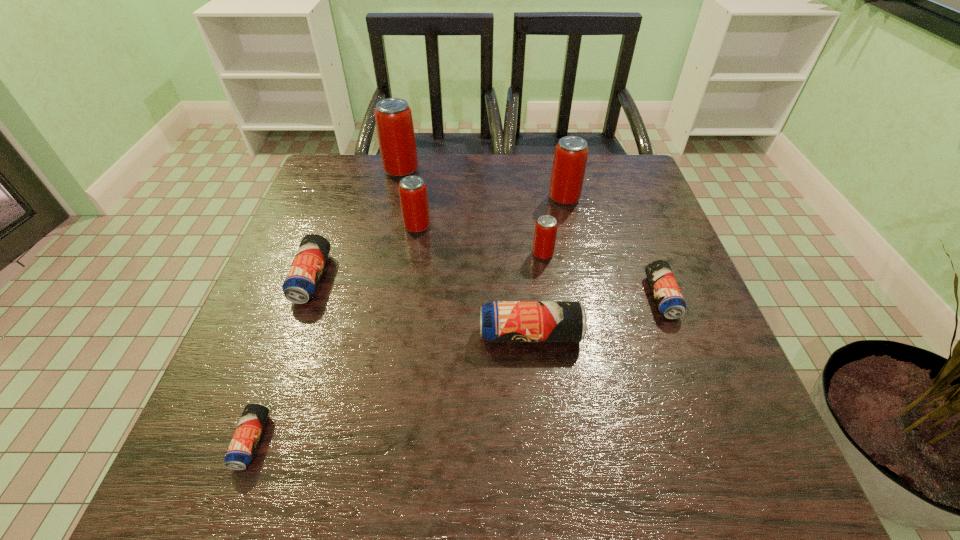
The width and height of the screenshot is (960, 540). I want to click on vacant space located on the back of the fourth shortest beer can, so pyautogui.click(x=521, y=249).

Identify the location of vacant region located on the back of the third shortest beer can. (334, 216).

I want to click on vacant space located on the front of the second smallest blue beer can, so click(682, 349).

The height and width of the screenshot is (540, 960). What are the coordinates of `vacant space located 0.360m on the right of the shortest object` in the screenshot? It's located at (482, 441).

I want to click on object at the near edge, so click(241, 450).

Identify the location of object that is at the right edge. (669, 299).

Locate an element on the screen. This screenshot has height=540, width=960. object that is at the near left corner is located at coordinates [x=241, y=450].

Where is `vacant region at the far edge of the desktop`? The width and height of the screenshot is (960, 540). vacant region at the far edge of the desktop is located at coordinates (583, 188).

Find the location of a particular element. vacant area at the near edge of the desktop is located at coordinates (552, 470).

The height and width of the screenshot is (540, 960). What are the coordinates of `free space at the left edge of the desktop` in the screenshot? It's located at (285, 254).